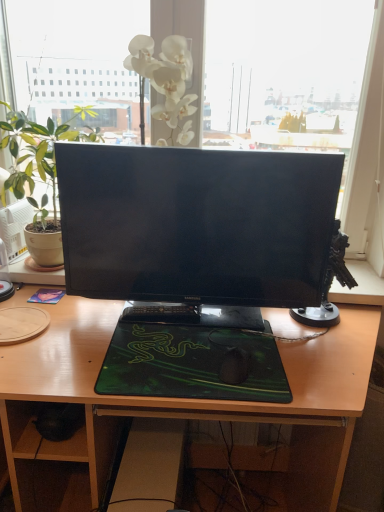
You are a GUI agent. You are given a task and a screenshot of the screen. Output one action in this format:
    pyautogui.click(x=<x>, y=<y>)
    Task: Click on the vacant space that is in between black matte mouse at center and black plastic keyboard at center
    The image size is (384, 512).
    Given the screenshot: What is the action you would take?
    pyautogui.click(x=193, y=339)